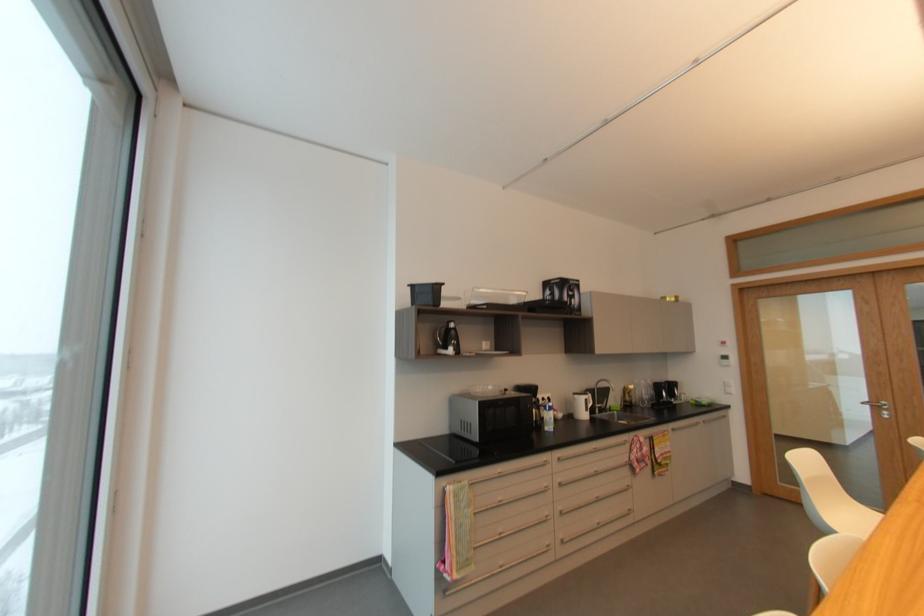
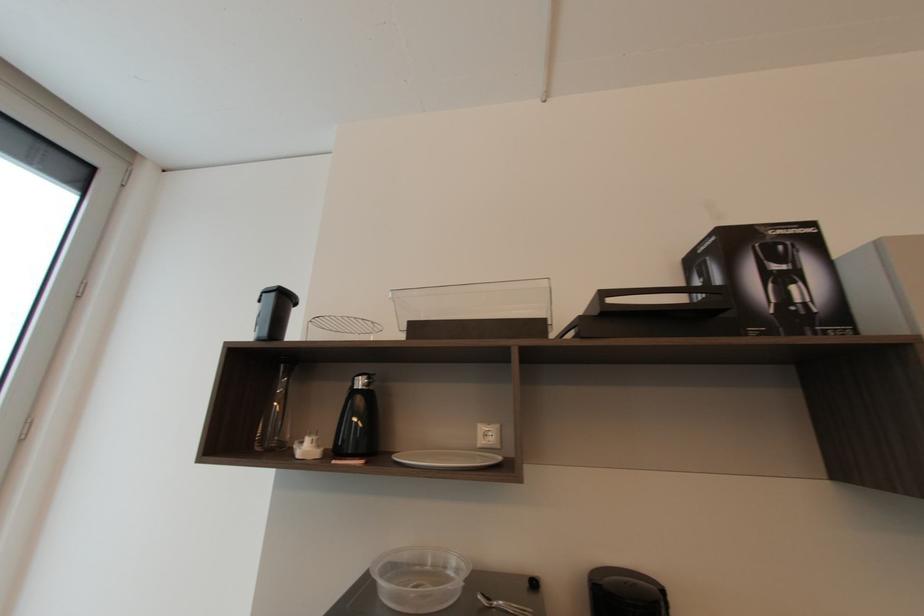
The point at (576,300) is marked in the first image. Where is the corresponding point in the second image?

(796, 288)